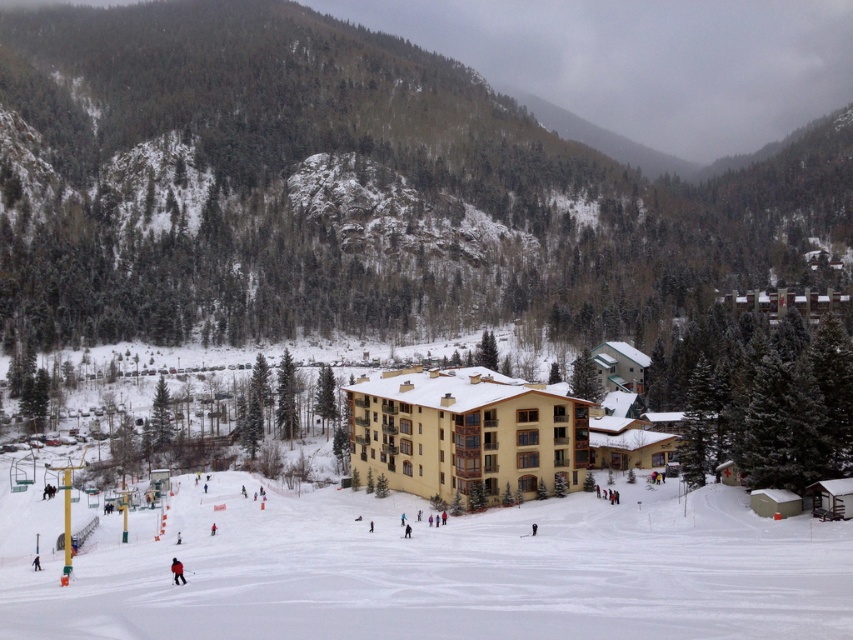
Question: Which of the following is the farthest from the observer?

Choices:
 (A) white snow ski slope at lower center
 (B) red fabric jacket at lower center

Answer: (B)

Question: Considering the relative positions of white snow ski slope at lower center and yellow wood hotel at center in the image provided, where is white snow ski slope at lower center located with respect to yellow wood hotel at center?

Choices:
 (A) right
 (B) left

Answer: (B)

Question: Does white snow ski slope at lower center have a larger size compared to red fabric jacket at lower center?

Choices:
 (A) yes
 (B) no

Answer: (A)

Question: Which point is farther from the camera taking this photo?

Choices:
 (A) (738, 534)
 (B) (178, 577)
 (C) (434, 416)

Answer: (C)

Question: Which point appears farthest from the camera in this image?

Choices:
 (A) (180, 564)
 (B) (619, 625)

Answer: (A)

Question: Can you confirm if white snow ski slope at lower center is bigger than yellow wood hotel at center?

Choices:
 (A) yes
 (B) no

Answer: (A)